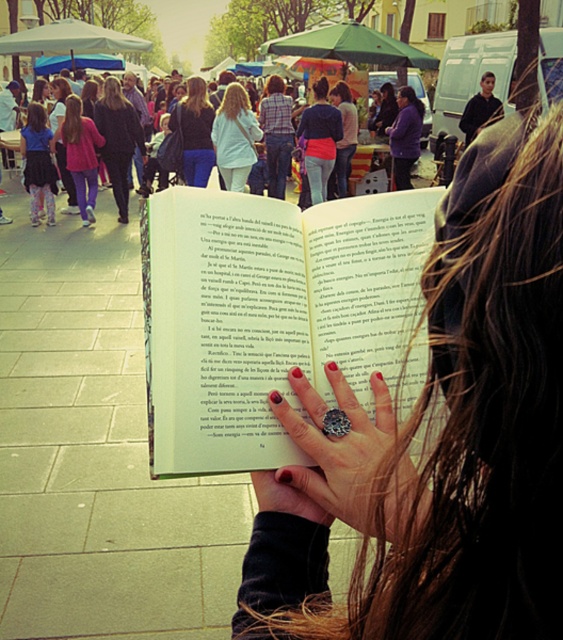
Question: Can you confirm if matte black book at center is positioned to the right of matte black jacket at center?

Choices:
 (A) no
 (B) yes

Answer: (A)

Question: Among these objects, which one is farthest from the camera?

Choices:
 (A) matte black book at center
 (B) dark blue jeans at center

Answer: (B)

Question: Among these points, which one is nearest to the camera?

Choices:
 (A) (159, 346)
 (B) (348, 92)
 (C) (102, 141)
 (D) (364, 460)

Answer: (D)

Question: Is paperback book at center to the right of matte pink pants at left from the viewer's perspective?

Choices:
 (A) yes
 (B) no

Answer: (A)

Question: Can you confirm if dark blue jeans at center is bigger than matte black jacket at center?

Choices:
 (A) yes
 (B) no

Answer: (A)

Question: Which object is closer to the camera taking this photo?

Choices:
 (A) polished silver ring at center
 (B) matte black jacket at center
 (C) matte black book at center
 (D) dark blue jeans at center

Answer: (C)